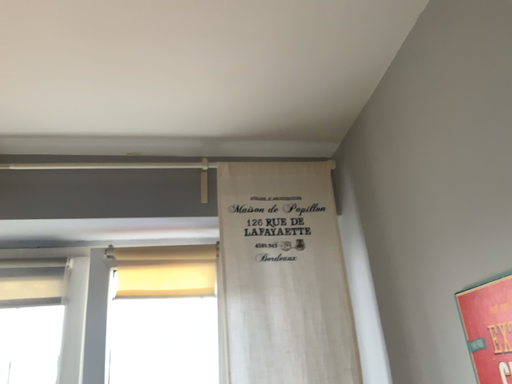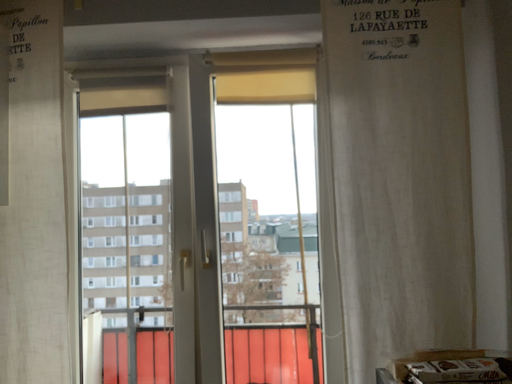
Question: Which way did the camera rotate in the video?

Choices:
 (A) rotated left
 (B) rotated right

Answer: (A)